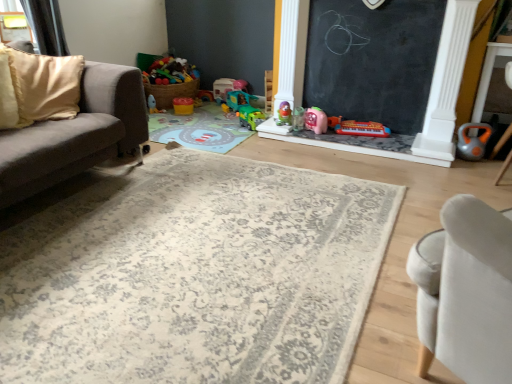
At what (x,y) coordinates should I click in order to perform the action: click on vacant space in front of yellow plastic cup at center, positioned as the ninth toy in right-to-left order. Please return your answer as a coordinate pair (x, y). This screenshot has height=384, width=512. Looking at the image, I should click on (181, 114).